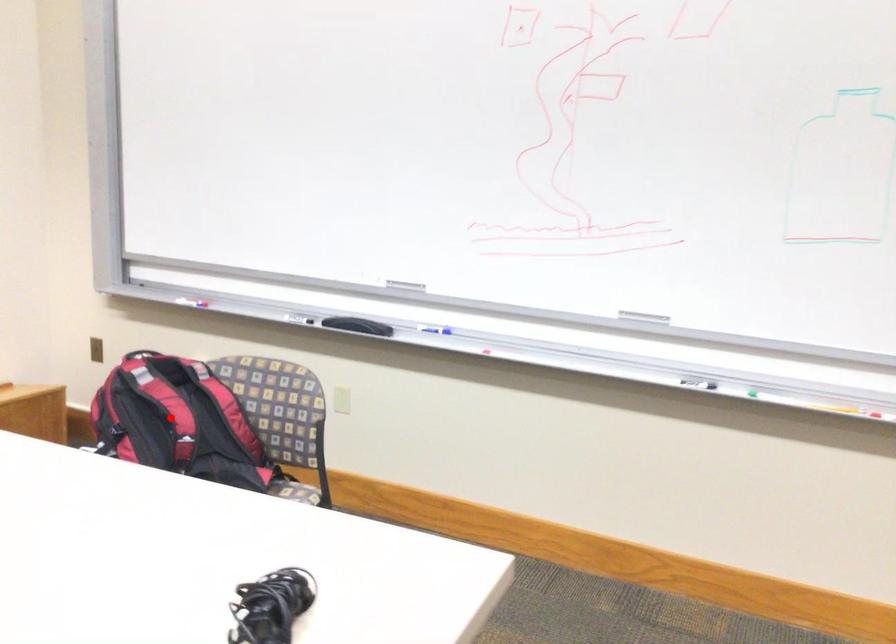
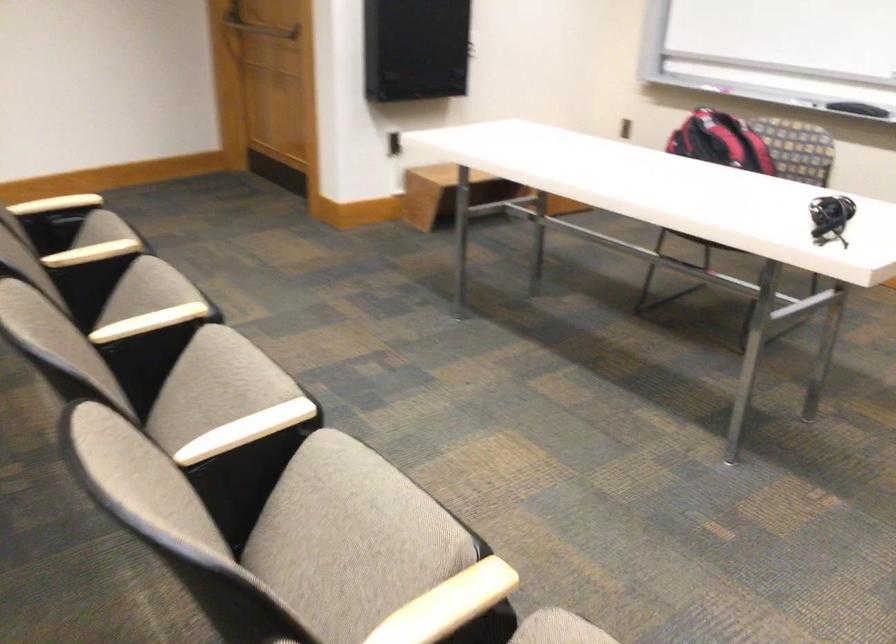
Question: I am providing you with two images of the same scene from different viewpoints. Image1 has a red point marked. In image2, the corresponding 3D location appears at what relative position? Reply with the corresponding letter.

Choices:
 (A) Closer
 (B) Farther

Answer: (B)